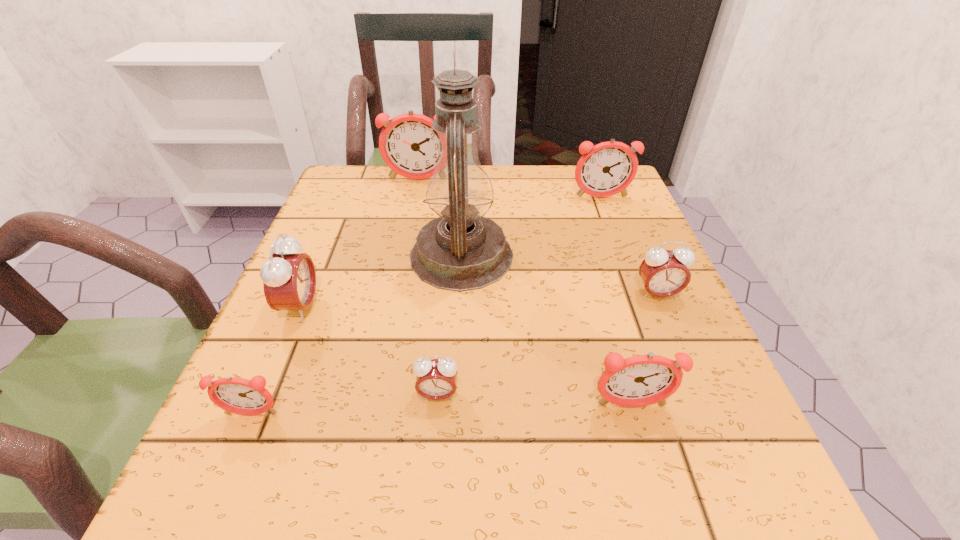
Identify the location of empty space that is in between the nearest pink alarm clock and the rightmost pink alarm clock. The image size is (960, 540). [x=547, y=345].

Identify the location of free point between the second farthest alarm clock and the farthest alarm clock. (510, 189).

The image size is (960, 540). I want to click on vacant point located between the rightmost pink alarm clock and the farthest alarm clock, so (x=538, y=237).

Locate an element on the screen. The width and height of the screenshot is (960, 540). empty location between the leftmost reddish-pink alarm clock and the oil lamp is located at coordinates (356, 335).

This screenshot has width=960, height=540. I want to click on vacant space that is in between the second smallest reddish-pink alarm clock and the second smallest pink alarm clock, so click(644, 350).

This screenshot has width=960, height=540. I want to click on free space that is in between the third biggest reddish-pink alarm clock and the oil lamp, so click(546, 330).

Identify which object is the fifth nearest to the second farthest alarm clock. Please provide its 2D coordinates. Your answer should be formatted as a tuple, i.e. [(x, y)], where the tuple contains the x and y coordinates of a point satisfying the conditions above.

[(436, 379)]

Select which object is the third closest to the second pink alarm clock from right to left. Please provide its 2D coordinates. Your answer should be formatted as a tuple, i.e. [(x, y)], where the tuple contains the x and y coordinates of a point satisfying the conditions above.

[(461, 250)]

Locate an element on the screen. the seventh closest alarm clock to the tallest object is located at coordinates (235, 395).

Locate which alarm clock is the sixth closest to the second biggest reddish-pink alarm clock. Please provide its 2D coordinates. Your answer should be formatted as a tuple, i.e. [(x, y)], where the tuple contains the x and y coordinates of a point satisfying the conditions above.

[(235, 395)]